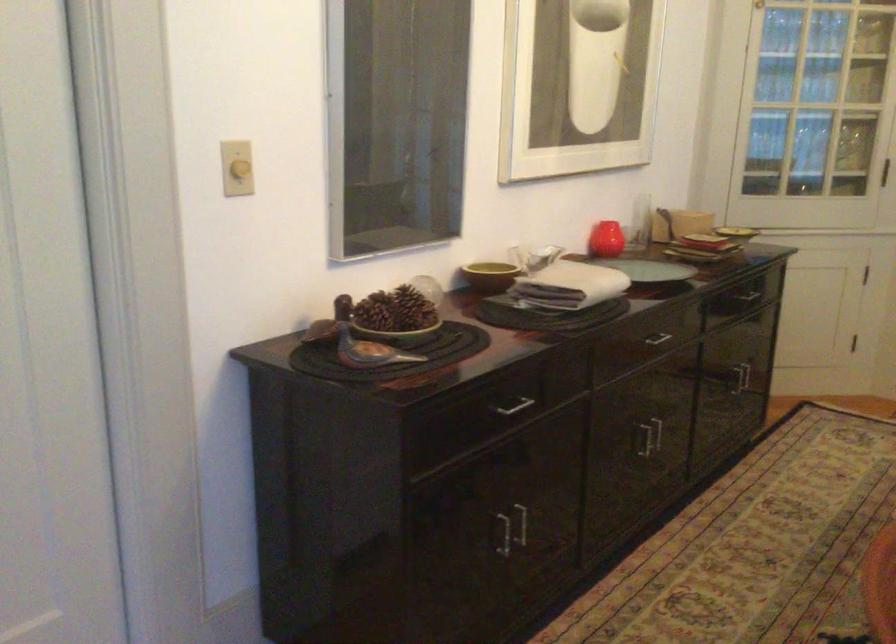
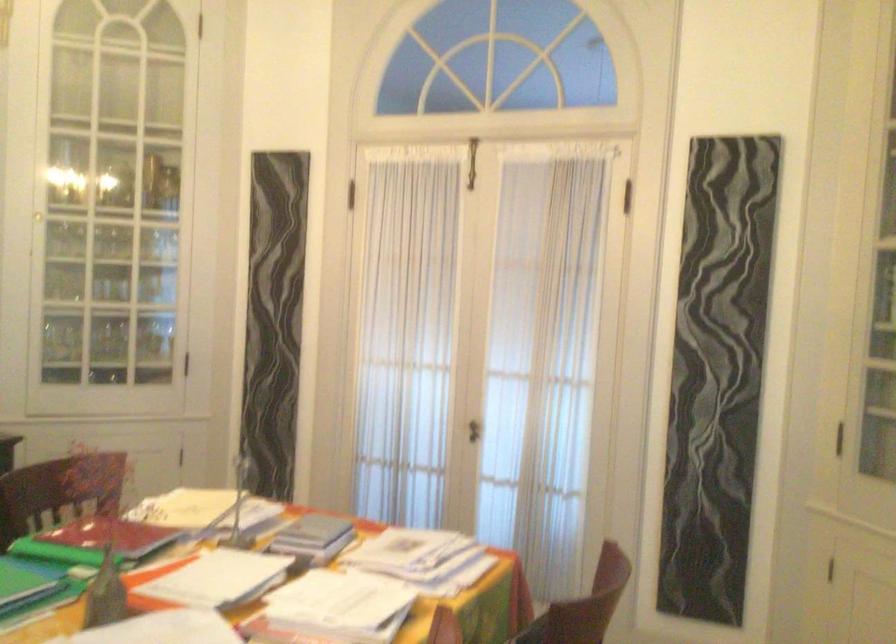
The images are taken continuously from a first-person perspective. In which direction are you moving?

The movement direction of the cameraman is right, backward.